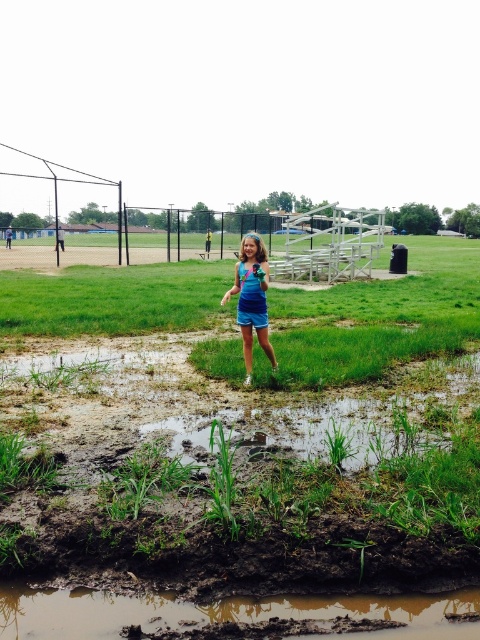
You are standing at the muddy patch in the park scene. You want to place a small toy that requires a flat surface. The green grass at center is located at coordinates point 0.706, 0.525. Can you place the toy there?

The green grass at center is located at point (252, 451), so yes, you can place the toy there as it provides a flat surface.

Looking at this image, you are standing at the point marked as point (x=252, y=451) in the image. Looking around, you see a muddy area with puddles and a girl wearing blue. What is the immediate surface you are standing on?

The immediate surface you are standing on is green grass at center, as the point (x=252, y=451) is located there.